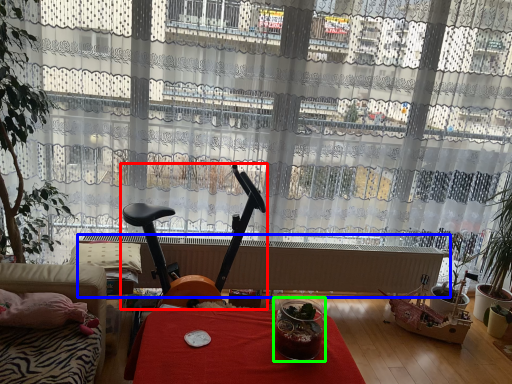
Question: Which is nearer to the swivel chair (highlighted by a red box)? radiator (highlighted by a blue box) or glass jar (highlighted by a green box).

Choices:
 (A) radiator
 (B) glass jar

Answer: (A)